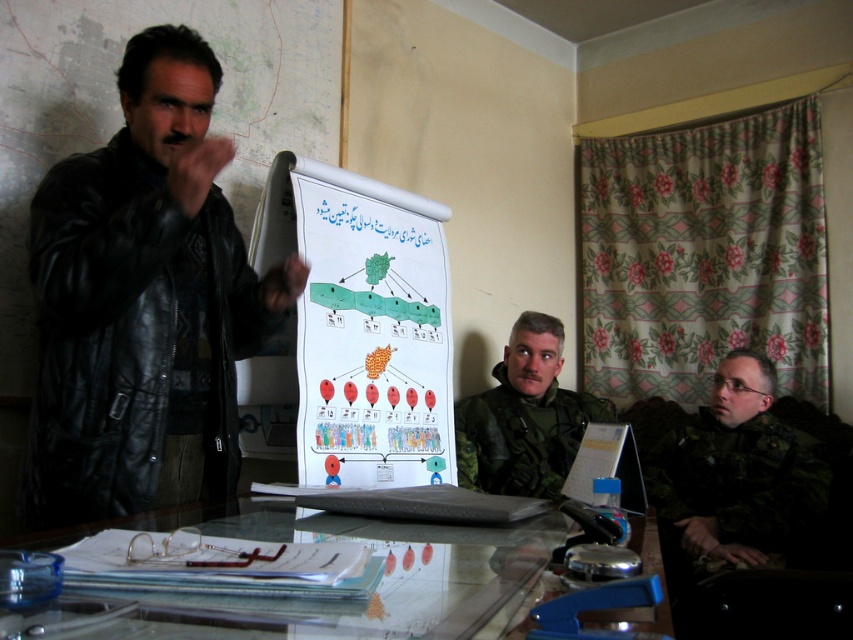
Question: Which point appears farthest from the camera in this image?

Choices:
 (A) (129, 172)
 (B) (532, 596)
 (C) (755, 550)
 (D) (349, 340)

Answer: (D)

Question: Is transparent glass table at center behind camouflage uniform at right?

Choices:
 (A) yes
 (B) no

Answer: (B)

Question: Considering the real-world distances, which object is farthest from the white paper poster at center?

Choices:
 (A) black leather jacket at left
 (B) transparent glass table at center
 (C) camouflage uniform at right
 (D) camouflage uniform at center

Answer: (B)

Question: Where is black leather jacket at left located in relation to camouflage uniform at center in the image?

Choices:
 (A) right
 (B) left

Answer: (B)

Question: Which point is closer to the camera?

Choices:
 (A) (463, 563)
 (B) (309, 204)
 (C) (206, 344)
 (D) (540, 444)

Answer: (A)

Question: Is camouflage uniform at right above camouflage uniform at center?

Choices:
 (A) yes
 (B) no

Answer: (B)